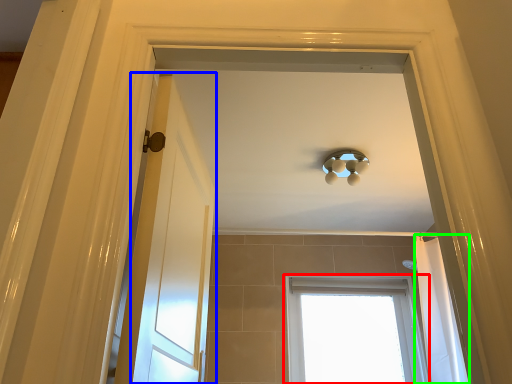
Question: Estimate the real-world distances between objects in this image. Which object is closer to window (highlighted by a red box), door (highlighted by a blue box) or shower curtain (highlighted by a green box)?

Choices:
 (A) door
 (B) shower curtain

Answer: (B)